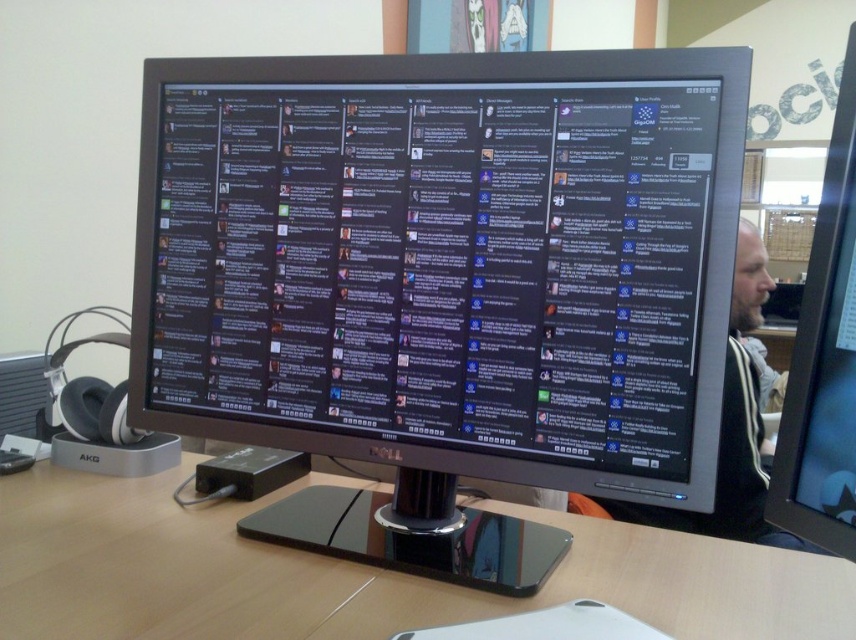
You are a photographer setting up a portrait shoot in this workspace. You want to position the bearded man at right so that the black glossy monitor at center is visible in the background. Should you place the man to the left or right of the monitor to achieve this?

You should place the bearded man at right to the right of the black glossy monitor at center so that the monitor remains visible in the background. According to the description, the black glossy monitor at center is to the left of the bearded man at right, meaning the monitor is positioned leftward relative to the man. By keeping the man to the right side of the monitor, the monitor will naturally appear in the background behind him during the portrait.

You are a furniture designer evaluating a workspace setup. The wooden table at center and bearded man at right are both in view. Which object occupies more horizontal space in the image?

The wooden table at center is wider than the bearded man at right, so it occupies more horizontal space in the image.